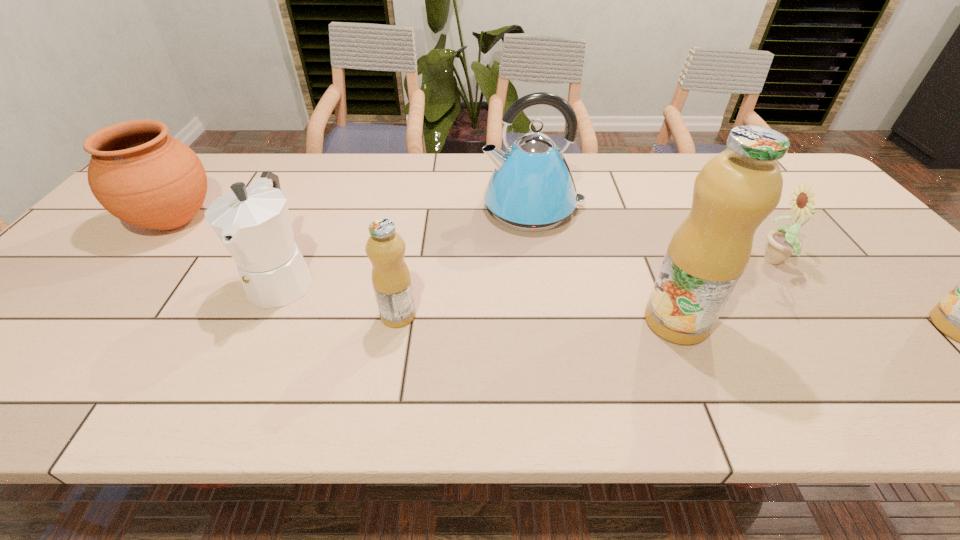
You are a GUI agent. You are given a task and a screenshot of the screen. Output one action in this format:
    pyautogui.click(x=<x>, y=<y>)
    Task: Click on the object located at the left edge
    The height and width of the screenshot is (540, 960).
    Given the screenshot: What is the action you would take?
    pyautogui.click(x=143, y=176)

Where is `vacant region at the far edge`? vacant region at the far edge is located at coordinates (448, 190).

Where is `vacant region at the near edge`? This screenshot has width=960, height=540. vacant region at the near edge is located at coordinates (415, 330).

Identify the location of free space at the left edge of the desktop. (x=113, y=262).

Locate an element on the screen. The width and height of the screenshot is (960, 540). vacant region between the fourth object from right to left and the leftmost object is located at coordinates (353, 214).

The image size is (960, 540). Identify the location of empty space between the fourth object from left to right and the leftmost object. (353, 214).

Locate an element on the screen. The height and width of the screenshot is (540, 960). unoccupied area between the sunflower and the sixth object from right to left is located at coordinates [x=530, y=270].

You are a GUI agent. You are given a task and a screenshot of the screen. Output one action in this format:
    pyautogui.click(x=<x>, y=<y>)
    Task: Click on the free space between the kettle and the second fruit juice from left to right
    
    Given the screenshot: What is the action you would take?
    pyautogui.click(x=604, y=265)

In order to click on empty space that is in between the pottery and the sixth object from left to right in this screenshot , I will do `click(476, 241)`.

The image size is (960, 540). What are the coordinates of `free spot between the leftmost object and the sunflower` in the screenshot? It's located at (476, 241).